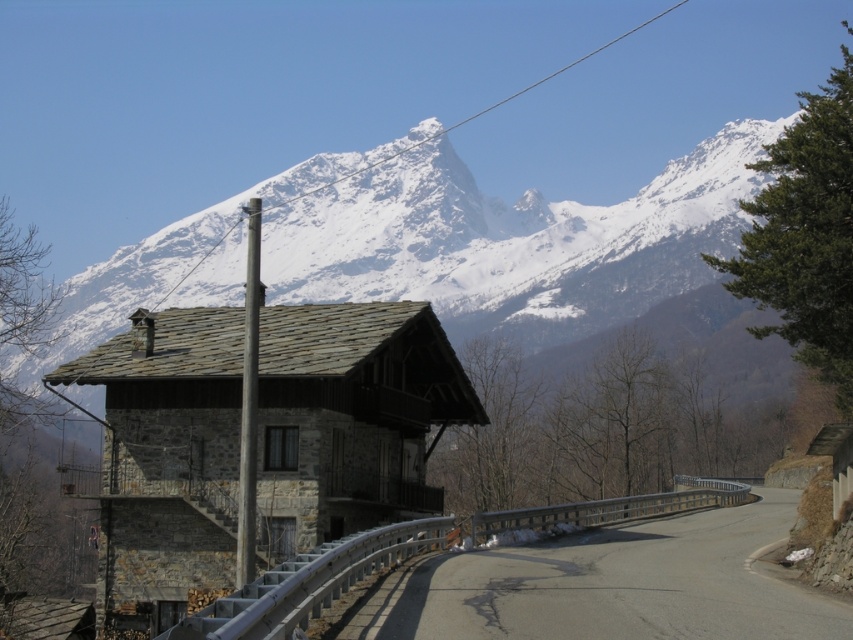
Question: Which of these objects is positioned farthest from the metallic gray pole at center?

Choices:
 (A) snowy granite mountain range at upper center
 (B) asphalt road at center

Answer: (A)

Question: Which object is farther from the camera taking this photo?

Choices:
 (A) metallic gray pole at center
 (B) asphalt road at center
 (C) snowy granite mountain range at upper center

Answer: (C)

Question: Is snowy granite mountain range at upper center closer to the viewer compared to asphalt road at center?

Choices:
 (A) yes
 (B) no

Answer: (B)

Question: Is asphalt road at center below metallic gray pole at center?

Choices:
 (A) no
 (B) yes

Answer: (B)

Question: Which point is farther from the camera taking this photo?

Choices:
 (A) (637, 554)
 (B) (253, 248)

Answer: (A)

Question: Is snowy granite mountain range at upper center thinner than metallic gray pole at center?

Choices:
 (A) no
 (B) yes

Answer: (A)